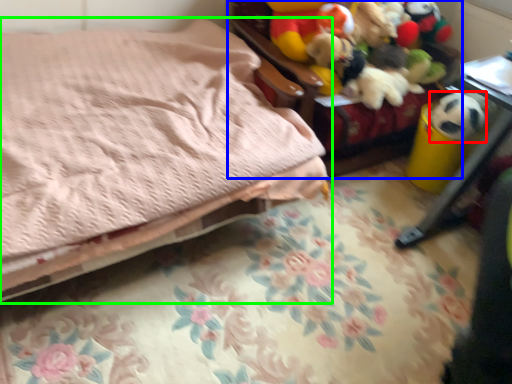
Question: Which object is positioned closest to animal (highlighted by a red box)? Select from furniture (highlighted by a blue box) and bed (highlighted by a green box).

Choices:
 (A) furniture
 (B) bed

Answer: (A)